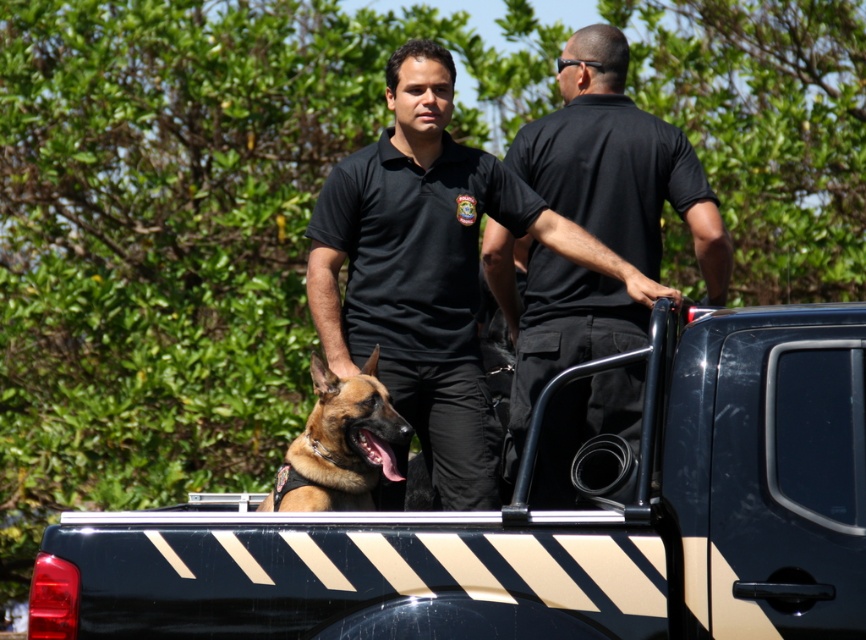
Question: Is black cotton shirt at center bigger than brown fur dog at center?

Choices:
 (A) yes
 (B) no

Answer: (A)

Question: Which object is closer to the camera taking this photo?

Choices:
 (A) metallic black truck bed at center
 (B) black cotton shirt at center
 (C) brown fur dog at center
 (D) black smooth shirt at upper right

Answer: (A)

Question: Estimate the real-world distances between objects in this image. Which object is closer to the black cotton shirt at center?

Choices:
 (A) metallic black truck bed at center
 (B) black smooth shirt at upper right
 (C) brown fur dog at center

Answer: (B)

Question: Is metallic black truck bed at center positioned before black cotton shirt at center?

Choices:
 (A) no
 (B) yes

Answer: (B)

Question: Can you confirm if metallic black truck bed at center is bigger than black cotton shirt at center?

Choices:
 (A) yes
 (B) no

Answer: (B)

Question: Estimate the real-world distances between objects in this image. Which object is farther from the brown fur dog at center?

Choices:
 (A) black cotton shirt at center
 (B) black smooth shirt at upper right

Answer: (B)